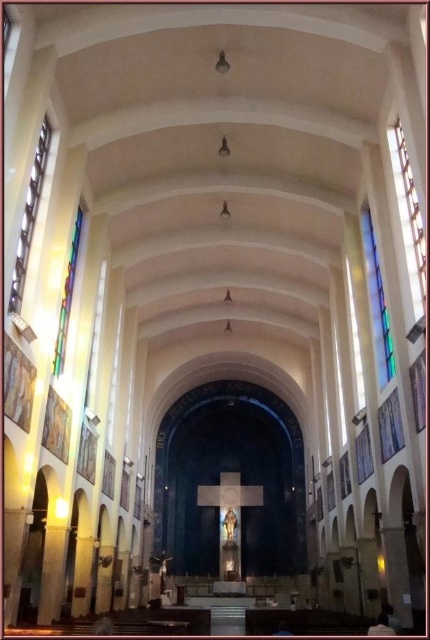
Who is positioned more to the left, stained glass window at right or multicolored stained glass at left?

Positioned to the left is multicolored stained glass at left.

Can you confirm if stained glass window at right is thinner than multicolored stained glass at left?

No, stained glass window at right is not thinner than multicolored stained glass at left.

Does point (423, 273) lie in front of point (67, 291)?

Yes, it is in front of point (67, 291).

Where is `stained glass window at right`? Image resolution: width=430 pixels, height=640 pixels. stained glass window at right is located at coordinates (408, 218).

What do you see at coordinates (408, 218) in the screenshot? I see `stained glass window at right` at bounding box center [408, 218].

How distant is stained glass window at right from clear glass window at left?

A distance of 29.75 meters exists between stained glass window at right and clear glass window at left.

The width and height of the screenshot is (430, 640). In order to click on stained glass window at right in this screenshot , I will do `click(408, 218)`.

Is stained glass window at right bigger than translucent stained glass at upper right?

Actually, stained glass window at right might be smaller than translucent stained glass at upper right.

The image size is (430, 640). What do you see at coordinates (408, 218) in the screenshot? I see `stained glass window at right` at bounding box center [408, 218].

You are a GUI agent. You are given a task and a screenshot of the screen. Output one action in this format:
    pyautogui.click(x=<x>, y=<y>)
    Task: Click on the stained glass window at right
    
    Given the screenshot: What is the action you would take?
    pyautogui.click(x=408, y=218)